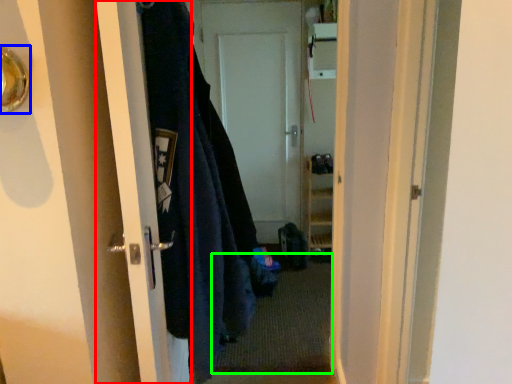
Question: Based on their relative distances, which object is farther from door (highlighted by a red box)? Choose from door handle (highlighted by a blue box) and doormat (highlighted by a green box).

Choices:
 (A) door handle
 (B) doormat

Answer: (B)